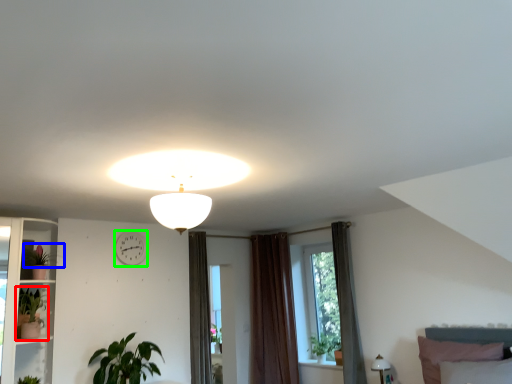
Question: Which object is the closest to the houseplant (highlighted by a red box)? Choose among these: plant (highlighted by a blue box) or clock (highlighted by a green box).

Choices:
 (A) plant
 (B) clock

Answer: (A)